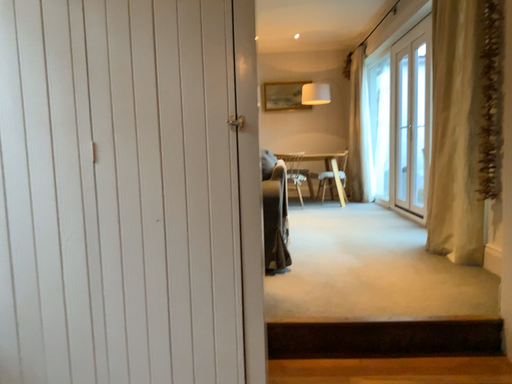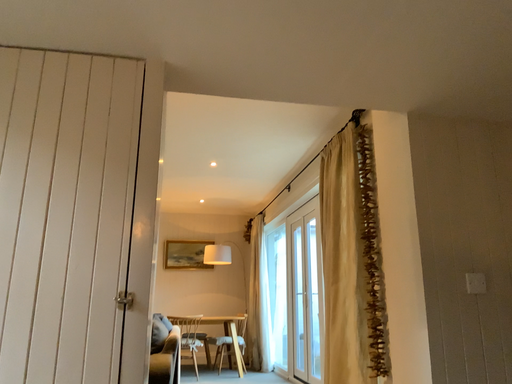
Question: Which way did the camera rotate in the video?

Choices:
 (A) rotated downward
 (B) rotated upward

Answer: (B)